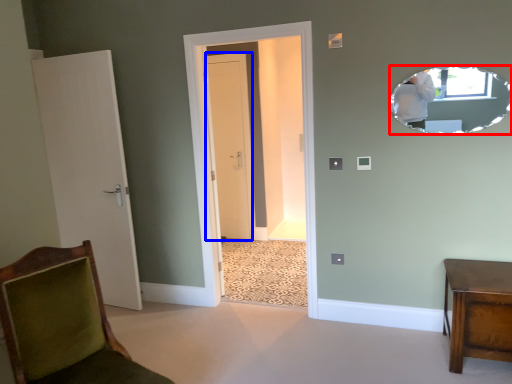
Question: Which point is closer to the camera, mirror (highlighted by a red box) or door (highlighted by a blue box)?

Choices:
 (A) mirror
 (B) door

Answer: (A)